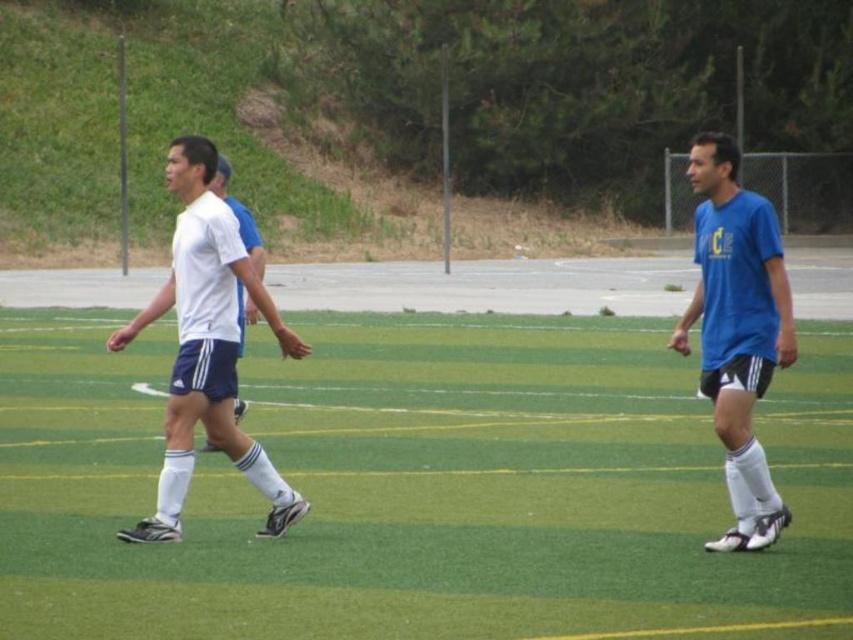
Question: Can you confirm if white matte shorts at center is positioned above blue matte shirt at center?

Choices:
 (A) no
 (B) yes

Answer: (A)

Question: Which of the following is the farthest from the observer?

Choices:
 (A) blue matte shirt at center
 (B) white matte shorts at center
 (C) green artificial turf at center

Answer: (B)

Question: Can you confirm if blue matte shirt at center is positioned to the left of white matte shirt at center?

Choices:
 (A) no
 (B) yes

Answer: (A)

Question: Which point is closer to the camera?

Choices:
 (A) white matte shorts at center
 (B) white matte shirt at center
 (C) green artificial turf at center

Answer: (C)

Question: Where is blue matte shirt at center located in relation to white matte shirt at center in the image?

Choices:
 (A) left
 (B) right

Answer: (B)

Question: Which of the following is the farthest from the observer?

Choices:
 (A) blue matte shirt at center
 (B) green artificial turf at center
 (C) white matte shorts at center

Answer: (C)